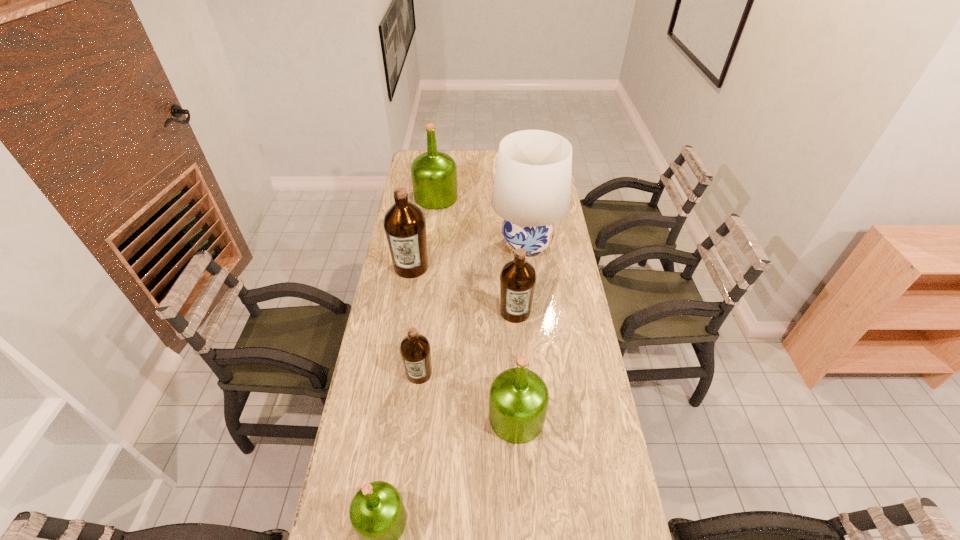
The width and height of the screenshot is (960, 540). I want to click on vacant space that satisfies the following two spatial constraints: 1. on the front-facing side of the blue lampshade; 2. on the label of the fifth nearest olive oil, so click(x=529, y=267).

This screenshot has width=960, height=540. Identify the location of blank space that satisfies the following two spatial constraints: 1. on the label of the biggest brown olive oil; 2. on the left side of the second nearest olive oil. (387, 417).